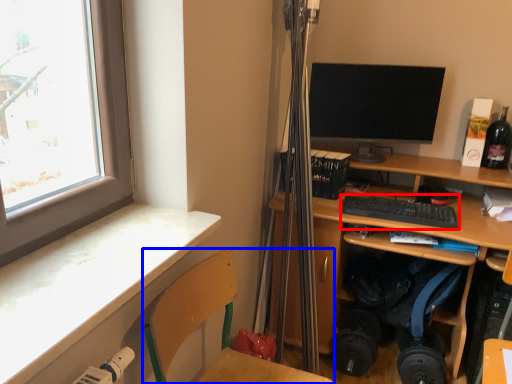
Question: Which object is further to the camera taking this photo, computer keyboard (highlighted by a red box) or folding chair (highlighted by a blue box)?

Choices:
 (A) computer keyboard
 (B) folding chair

Answer: (A)